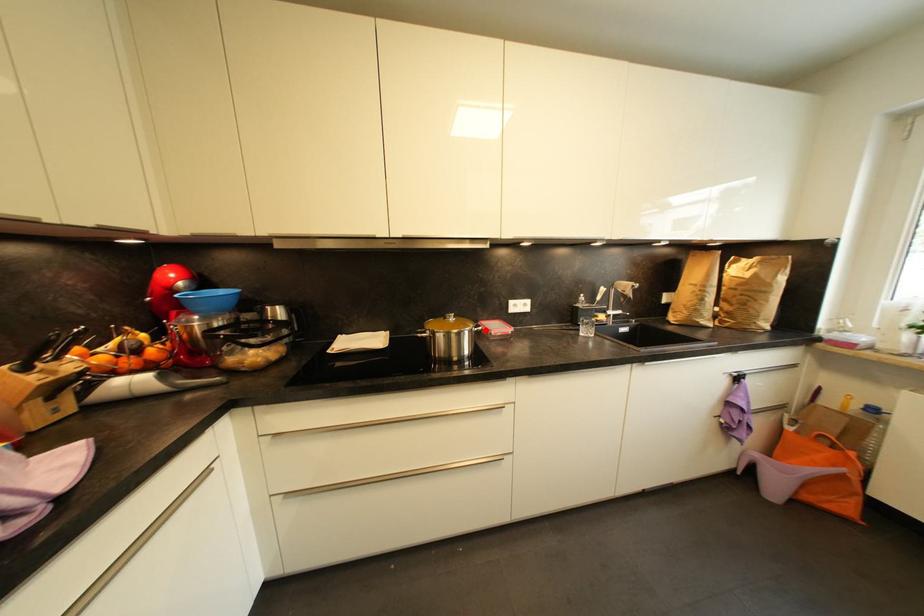
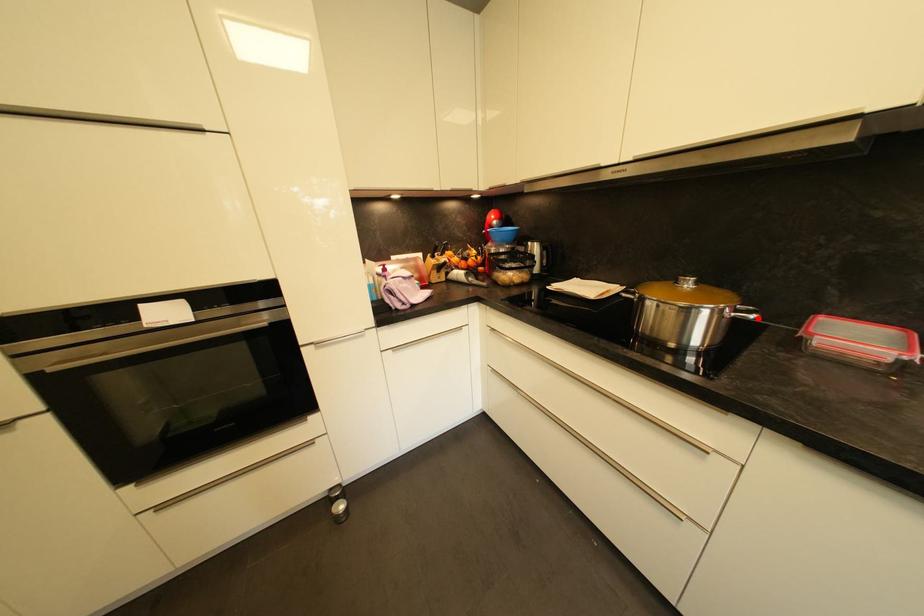
I am providing you with two images of the same scene from different viewpoints. A red point is marked on the first image and another point is marked on the second image. Is the red point in image1 aligned with the point shown in image2?

Yes